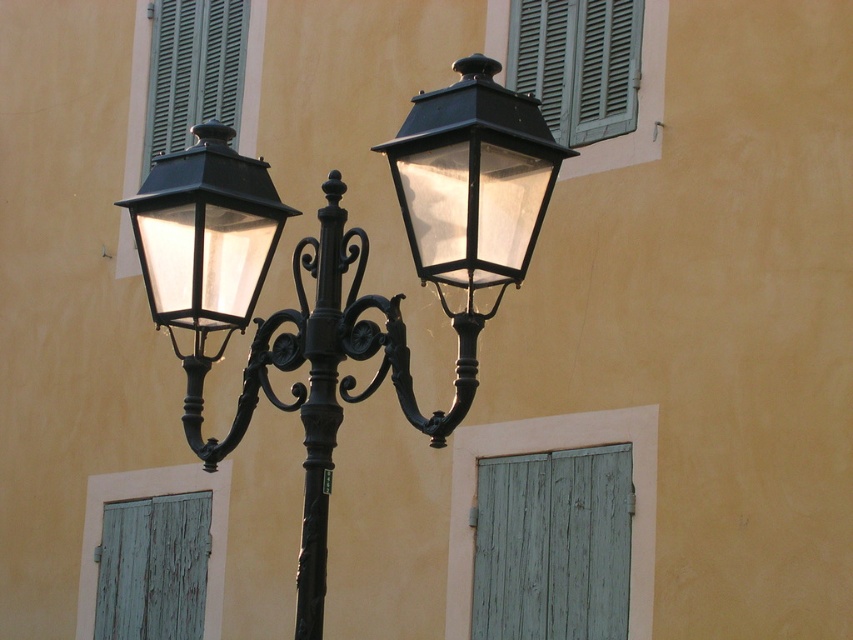
Can you confirm if green matte shutters at upper right is thinner than green matte shutter at upper left?

Correct, green matte shutters at upper right's width is less than green matte shutter at upper left's.

Which is behind, point (596, 19) or point (181, 3)?

The point (181, 3) is more distant.

Who is more forward, (602, 49) or (204, 77)?

A: Positioned in front is point (602, 49).

This screenshot has width=853, height=640. I want to click on green matte shutters at upper right, so click(578, 64).

Can you confirm if green matte shutters at upper right is taller than black wrought iron pole at center?

In fact, green matte shutters at upper right may be shorter than black wrought iron pole at center.

Can you confirm if green matte shutters at upper right is wider than black wrought iron pole at center?

Yes, green matte shutters at upper right is wider than black wrought iron pole at center.

Does point (614, 24) lie in front of point (317, 568)?

That is False.

Image resolution: width=853 pixels, height=640 pixels. In order to click on green matte shutters at upper right in this screenshot , I will do `click(578, 64)`.

Does matte black lantern at center lie behind black wrought iron pole at center?

No, matte black lantern at center is closer to the viewer.

Does matte black lantern at center come in front of black wrought iron pole at center?

Yes, it is.

You are a GUI agent. You are given a task and a screenshot of the screen. Output one action in this format:
    pyautogui.click(x=<x>, y=<y>)
    Task: Click on the matte black lantern at center
    
    Given the screenshot: What is the action you would take?
    pyautogui.click(x=473, y=179)

Locate an element on the screen. Image resolution: width=853 pixels, height=640 pixels. matte black lantern at center is located at coordinates (473, 179).